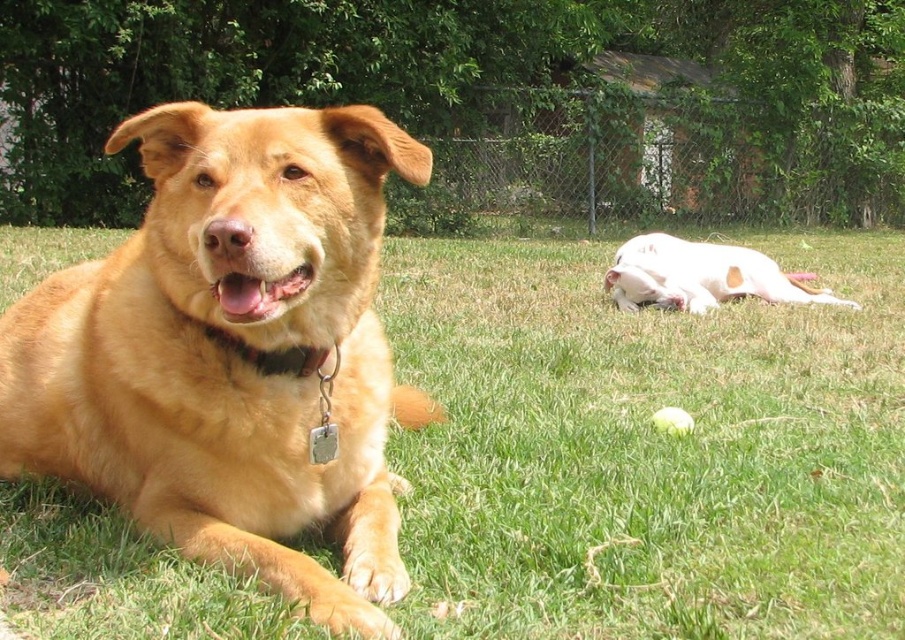
Which is more to the right, green grass at center or brown leather collar at center?

brown leather collar at center is more to the right.

Is the position of green grass at center less distant than that of brown leather collar at center?

Yes, green grass at center is closer to the viewer.

At what (x,y) coordinates should I click in order to perform the action: click on green grass at center. Please return your answer as a coordinate pair (x, y). The height and width of the screenshot is (640, 905). Looking at the image, I should click on 648,445.

Is golden fur dog at center wider than white smooth dog at right?

In fact, golden fur dog at center might be narrower than white smooth dog at right.

Image resolution: width=905 pixels, height=640 pixels. Identify the location of golden fur dog at center. pos(232,353).

Does point (293, 248) come farther from viewer compared to point (732, 291)?

No, (293, 248) is in front of (732, 291).

The width and height of the screenshot is (905, 640). In order to click on golden fur dog at center in this screenshot , I will do `click(232, 353)`.

Identify the location of white smooth dog at right. The image size is (905, 640). (700, 275).

Is white smooth dog at right shorter than brown leather collar at center?

Incorrect, white smooth dog at right's height does not fall short of brown leather collar at center's.

At what (x,y) coordinates should I click in order to perform the action: click on white smooth dog at right. Please return your answer as a coordinate pair (x, y). This screenshot has height=640, width=905. Looking at the image, I should click on (700, 275).